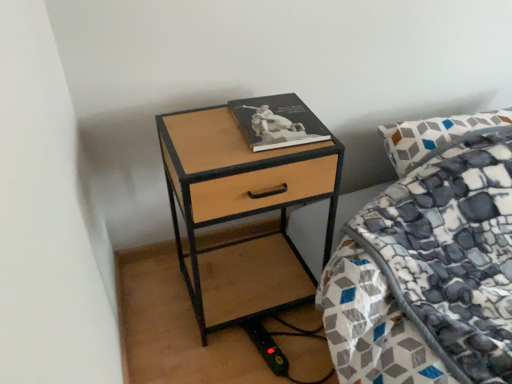
This screenshot has width=512, height=384. I want to click on free spot in front of hardcover book at upper right, so click(248, 150).